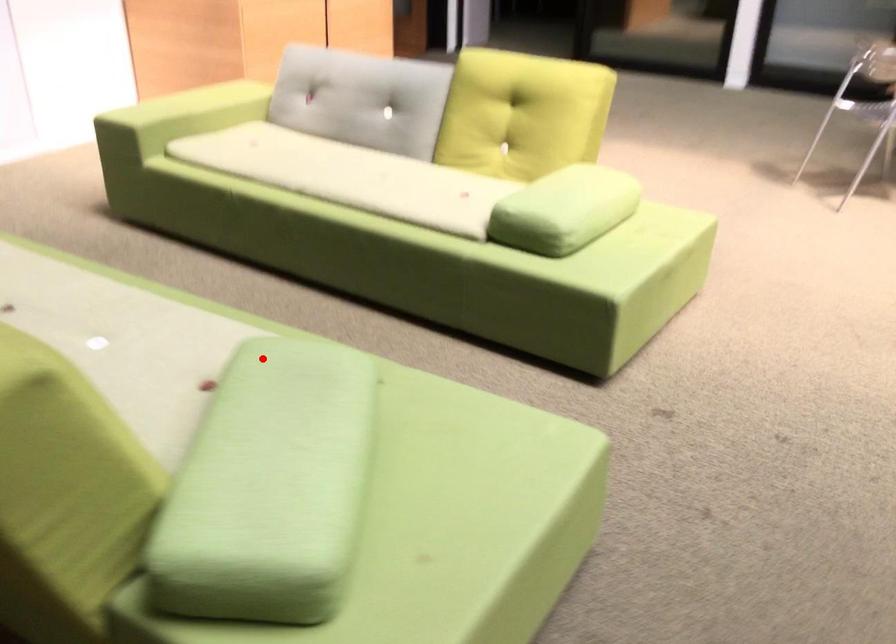
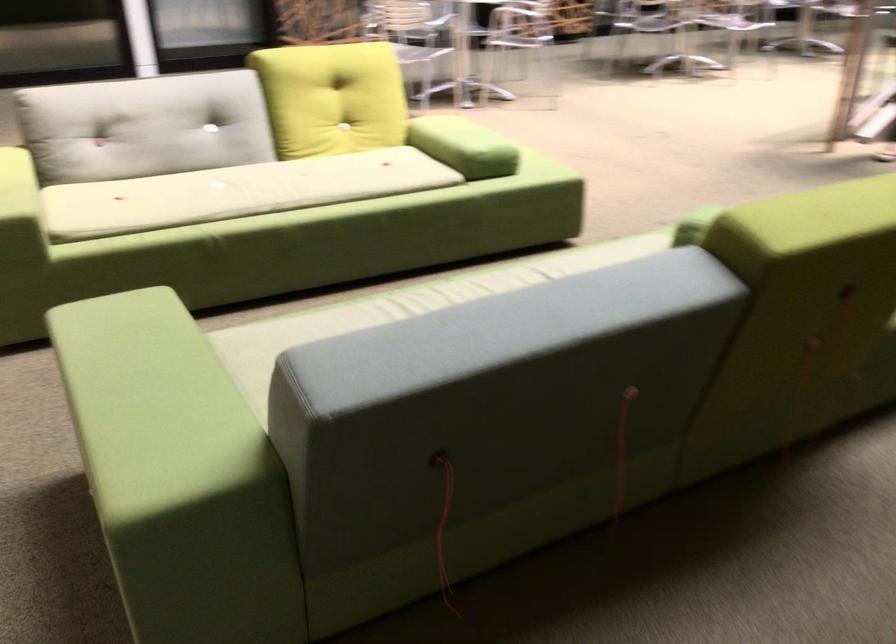
Question: A red point is marked in image1. In image2, is the corresponding 3D point closer to the camera or farther? Reply with the corresponding letter.

Choices:
 (A) The corresponding 3D point is closer.
 (B) The corresponding 3D point is farther.

Answer: (B)